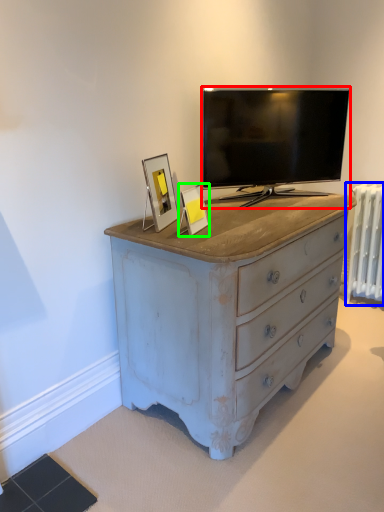
Question: Which is farther away from television (highlighted by a red box)? radiator (highlighted by a blue box) or picture frame (highlighted by a green box)?

Choices:
 (A) radiator
 (B) picture frame

Answer: (A)